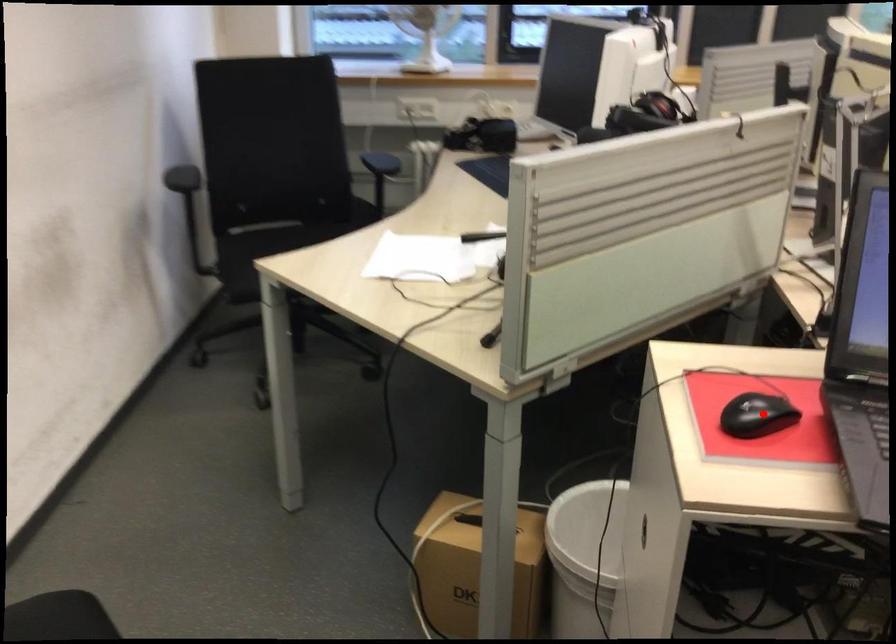
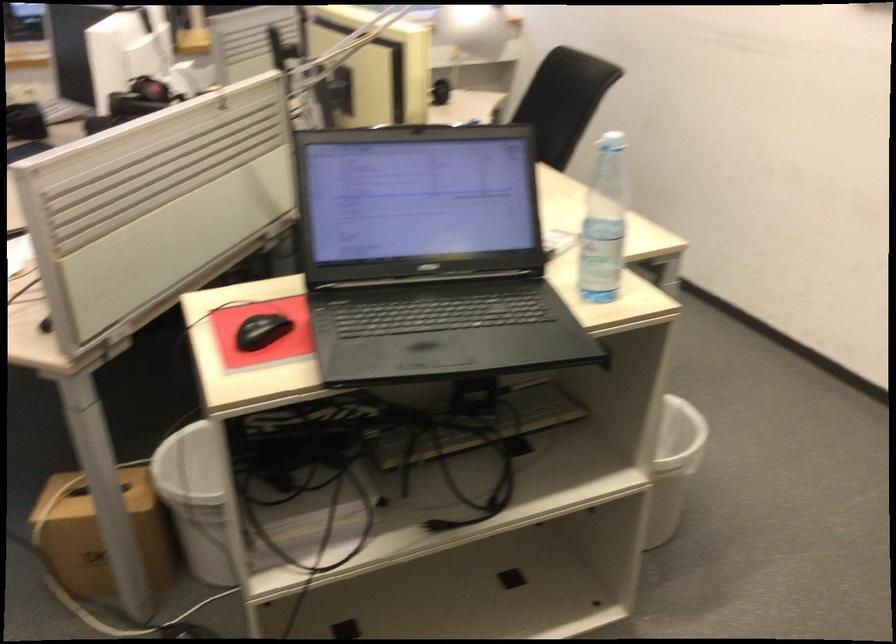
Where in the second image is the point corresponding to the highlighted location from the first image?

(261, 330)